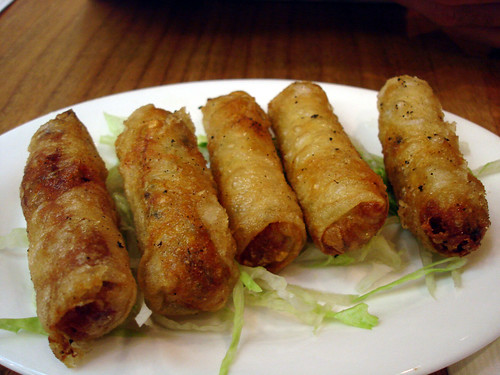
Locate an element on the screen. The width and height of the screenshot is (500, 375). counter/table off edge metal is located at coordinates (15, 7).